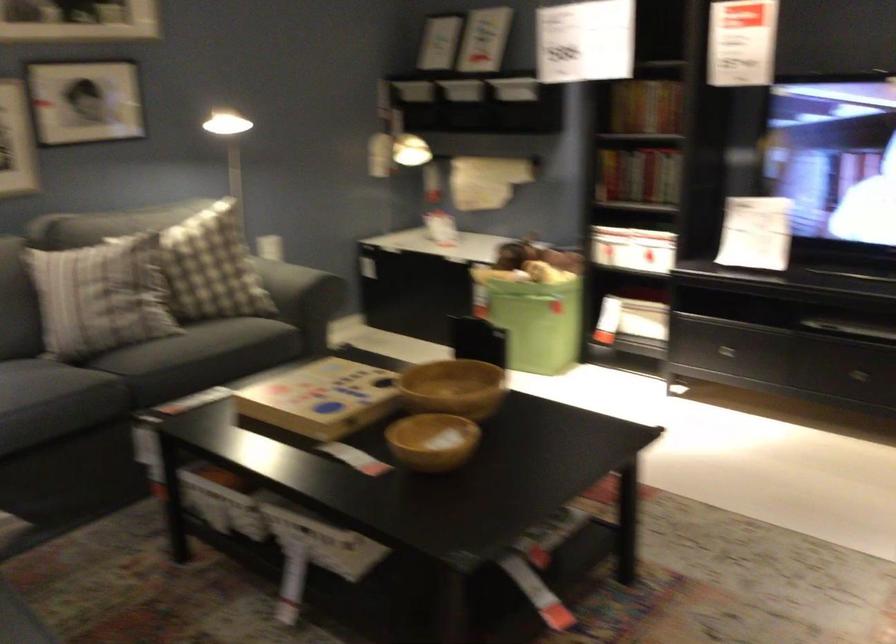
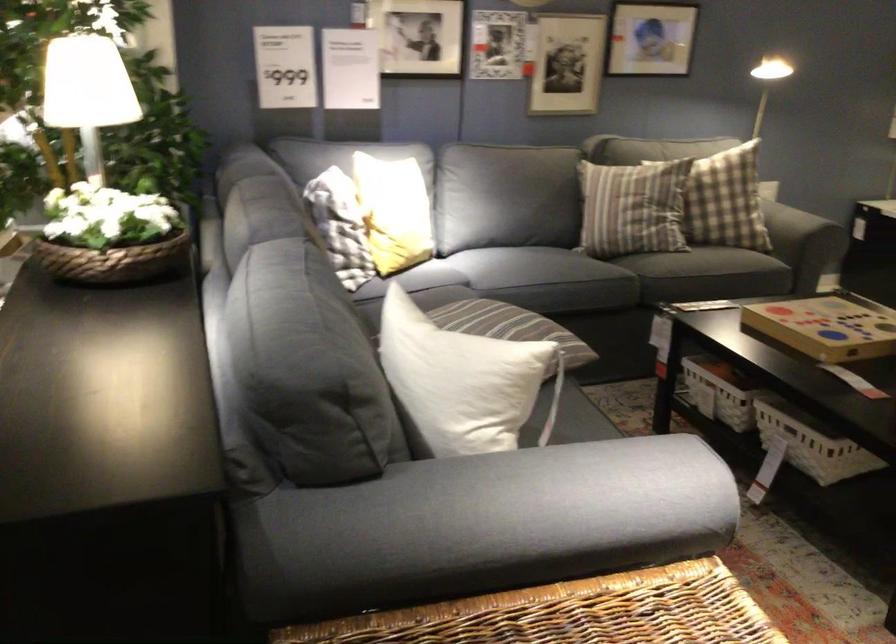
Find the pixel in the second image that matches point (312, 410) in the first image.

(828, 326)